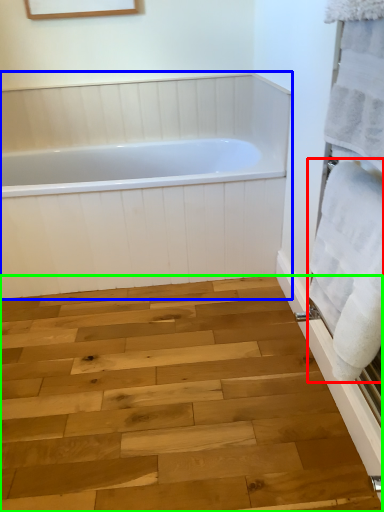
Question: Which object is the farthest from bath towel (highlighted by a red box)? Choose among these: bathtub (highlighted by a blue box) or plank (highlighted by a green box).

Choices:
 (A) bathtub
 (B) plank

Answer: (A)